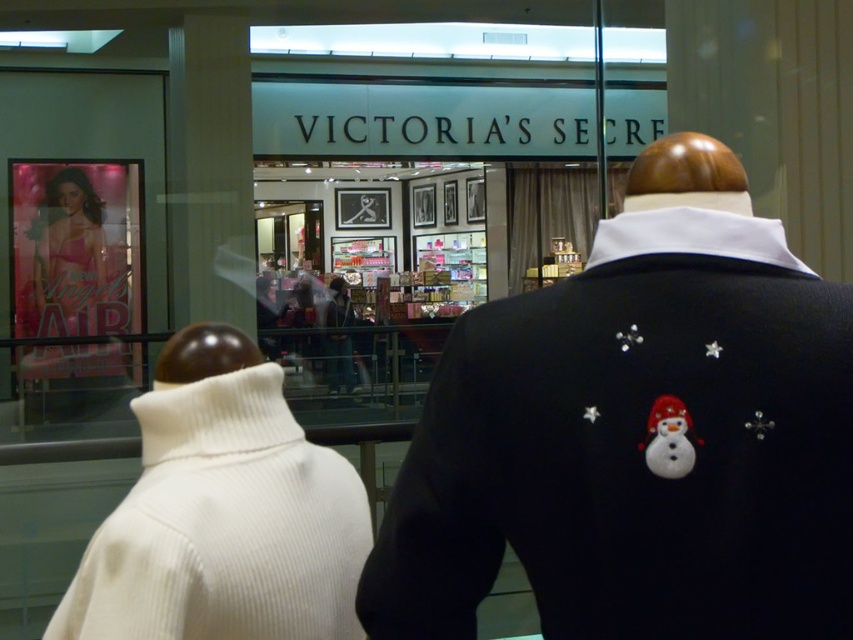
Which is behind, point (51, 250) or point (651, 406)?

Point (51, 250)

Is matte pink lingerie at left above white glossy snowman at center?

Yes, matte pink lingerie at left is above white glossy snowman at center.

Describe the element at coordinates (70, 253) in the screenshot. I see `matte pink lingerie at left` at that location.

Where is `matte pink lingerie at left`? matte pink lingerie at left is located at coordinates (70, 253).

Does white ribbed sweater at left have a lesser height compared to white glossy snowman at center?

Incorrect, white ribbed sweater at left's height does not fall short of white glossy snowman at center's.

Does white ribbed sweater at left appear over white glossy snowman at center?

Incorrect, white ribbed sweater at left is not positioned above white glossy snowman at center.

What do you see at coordinates (224, 525) in the screenshot? The image size is (853, 640). I see `white ribbed sweater at left` at bounding box center [224, 525].

The width and height of the screenshot is (853, 640). What are the coordinates of `white ribbed sweater at left` in the screenshot? It's located at (224, 525).

Is white ribbed sweater at left thinner than matte pink lingerie at left?

Indeed, white ribbed sweater at left has a lesser width compared to matte pink lingerie at left.

Who is positioned more to the right, white ribbed sweater at left or matte pink lingerie at left?

Positioned to the right is white ribbed sweater at left.

What do you see at coordinates (224, 525) in the screenshot? I see `white ribbed sweater at left` at bounding box center [224, 525].

This screenshot has height=640, width=853. What are the coordinates of `white ribbed sweater at left` in the screenshot? It's located at pyautogui.click(x=224, y=525).